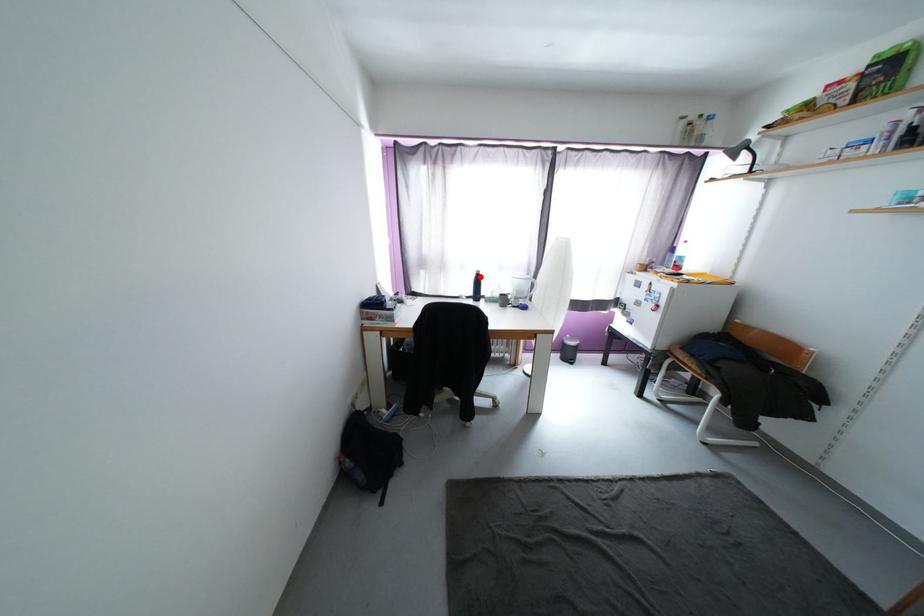
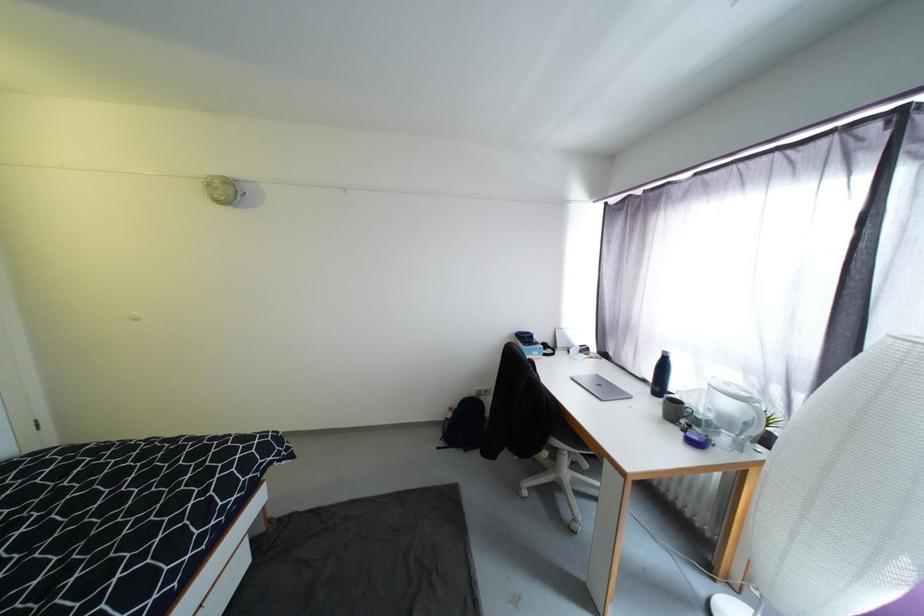
Find the pixel in the second image that matches the highlighted location in the first image.

(665, 358)